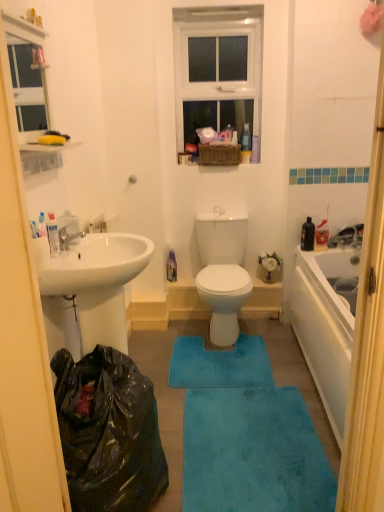
Question: Is white plastic toothpaste tube at left taller or shorter than blue plush bath mat at center, which is the 1th bath mat in back-to-front order?

Choices:
 (A) short
 (B) tall

Answer: (B)

Question: Is white plastic toothpaste tube at left bigger or smaller than blue plush bath mat at center, which ranks as the second bath mat in bottom-to-top order?

Choices:
 (A) big
 (B) small

Answer: (B)

Question: Which is farther from the white plastic toothpaste tube at left?

Choices:
 (A) blue plush bath mat at center, which ranks as the second bath mat in bottom-to-top order
 (B) clear glass window screen at upper left
 (C) matte silver faucet at left
 (D) blue plush bath mat at center, the 2th bath mat from the top
 (E) black plastic bag at lower left

Answer: (B)

Question: Estimate the real-world distances between objects in this image. Which object is closer to the white plastic window at upper center?

Choices:
 (A) matte silver faucet at left
 (B) blue plush bath mat at center, positioned as the 2th bath mat in back-to-front order
 (C) clear glass window screen at upper left
 (D) black plastic bag at lower left
 (E) blue plush bath mat at center, which ranks as the second bath mat in bottom-to-top order

Answer: (C)